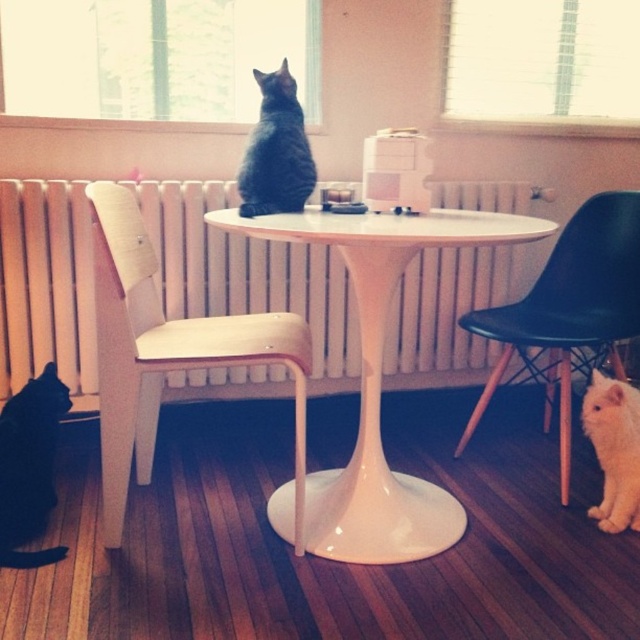
You are a small toy mouse that is 5 cm tall. You want to place yourself on the white glossy table at center so that the black fur cat at lower left can see you. Will the cat be able to see you if you are placed on the table?

The white glossy table at center has a greater height compared to black fur cat at lower left. Since the table is taller than the cat, placing the toy mouse on the table would position it above the cat, making it visible to the black fur cat at lower left.

You are trying to place a small decorative item on the white glossy table at center. Considering the size of the white fluffy cat at lower right, can you estimate if there is enough space on the table?

The white glossy table at center is wider than the white fluffy cat at lower right, so there should be sufficient space to place a small decorative item on the table.

You are a guest entering the dining area and want to sit down at the white glossy table at center. However, there is a black fur cat at lower left in the way. Based on their positions, can you easily walk around the cat to reach the table?

The white glossy table at center is located above the black fur cat at lower left, meaning the cat is positioned lower in the scene. Since the cat is at a lower position, you can likely walk around it to reach the table without much difficulty.